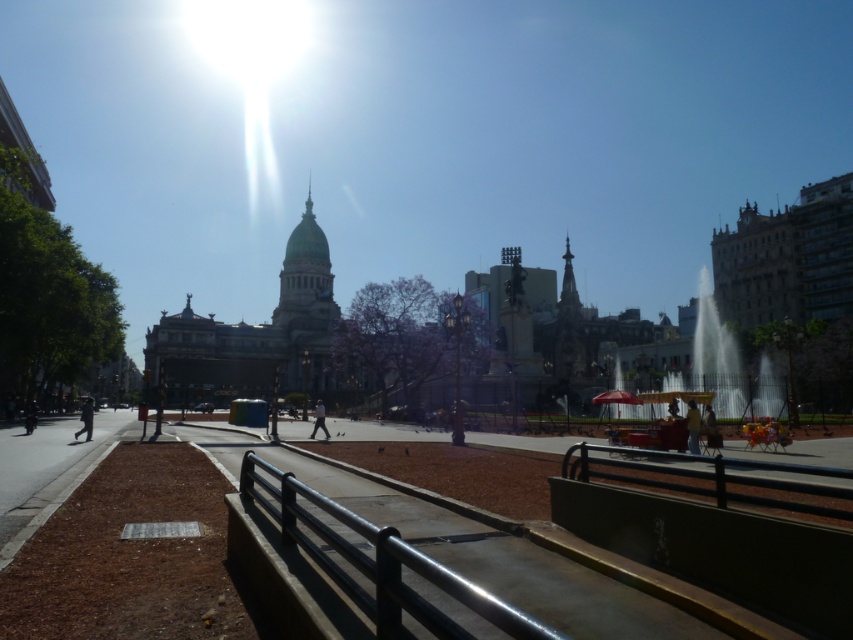
You are a GUI agent. You are given a task and a screenshot of the screen. Output one action in this format:
    pyautogui.click(x=<x>, y=<y>)
    Task: Click on the metallic fountain at center right
    The image size is (853, 640).
    Given the screenshot: What is the action you would take?
    pyautogui.click(x=704, y=369)

Can you confirm if metallic fountain at center right is smaller than dark gray pants at lower left?

Actually, metallic fountain at center right might be larger than dark gray pants at lower left.

Is point (701, 410) less distant than point (76, 435)?

No.

Find the location of `metallic fountain at center right`. metallic fountain at center right is located at coordinates (704, 369).

Does dark gray pants at lower left have a lesser width compared to light blue jeans at center?

No.

The height and width of the screenshot is (640, 853). What do you see at coordinates (86, 419) in the screenshot? I see `dark gray pants at lower left` at bounding box center [86, 419].

Between point (91, 417) and point (326, 436), which one is positioned behind?

The point (326, 436) is behind.

This screenshot has height=640, width=853. I want to click on dark gray pants at lower left, so click(86, 419).

Who is lower down, metallic fountain at center right or yellow fabric umbrella at center?

Positioned lower is yellow fabric umbrella at center.

Does metallic fountain at center right have a greater height compared to yellow fabric umbrella at center?

Yes.

Measure the distance between point (x=764, y=394) and camera.

Point (x=764, y=394) and camera are 93.54 meters apart from each other.

The height and width of the screenshot is (640, 853). Find the location of `metallic fountain at center right`. metallic fountain at center right is located at coordinates (704, 369).